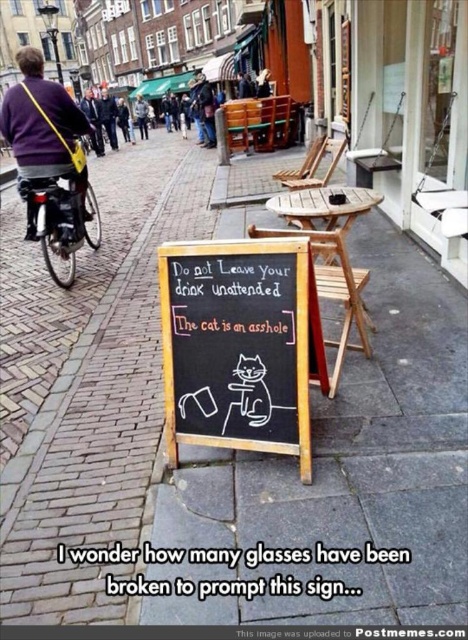
Question: Does black chalkboard at center appear over brown leather jacket at upper left?

Choices:
 (A) no
 (B) yes

Answer: (A)

Question: Which of the following is the closest to the observer?

Choices:
 (A) (23, 49)
 (B) (65, 289)
 (C) (242, 308)
 (D) (112, 128)

Answer: (C)

Question: Which of the following is the farthest from the observer?

Choices:
 (A) dark blue sweater at upper left
 (B) purple fabric bag at upper left
 (C) brown leather jacket at upper left
 (D) black chalkboard at center

Answer: (A)

Question: Can you confirm if black chalkboard at center is smaller than black matte bicycle at left?

Choices:
 (A) yes
 (B) no

Answer: (A)

Question: Does purple fabric bag at upper left have a lesser width compared to black matte bicycle at left?

Choices:
 (A) yes
 (B) no

Answer: (B)

Question: Among these objects, which one is nearest to the camera?

Choices:
 (A) dark blue sweater at upper left
 (B) purple fabric bag at upper left
 (C) brown leather jacket at upper left

Answer: (B)